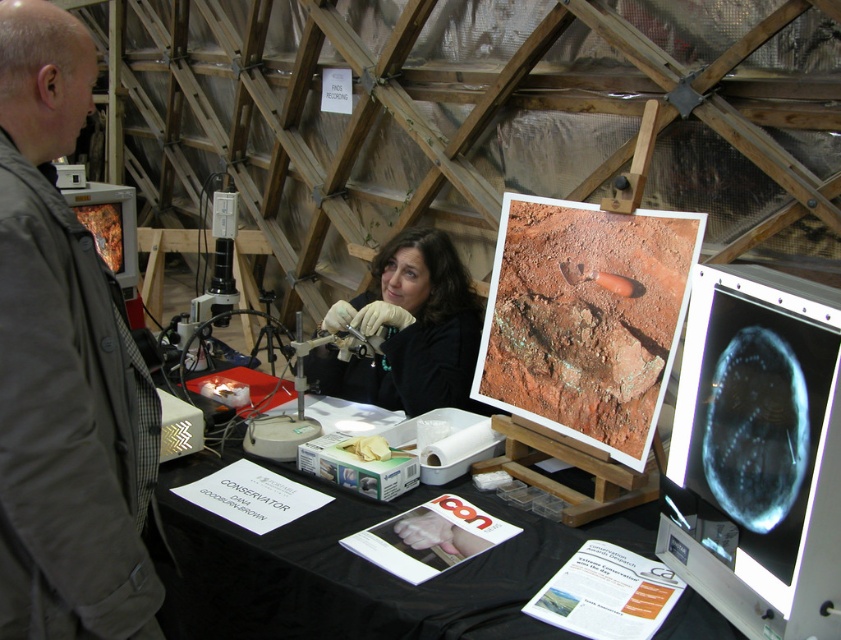
Question: Which point is farther to the camera?

Choices:
 (A) (x=101, y=266)
 (B) (x=484, y=630)
 (C) (x=78, y=198)

Answer: (C)

Question: Is blue glossy monitor at upper right closer to camera compared to metallic orange computer monitor at left?

Choices:
 (A) no
 (B) yes

Answer: (B)

Question: Considering the relative positions of blue glossy monitor at upper right and matte black gloves at center in the image provided, where is blue glossy monitor at upper right located with respect to matte black gloves at center?

Choices:
 (A) left
 (B) right

Answer: (B)

Question: Does black paper table at center appear over matte black gloves at center?

Choices:
 (A) yes
 (B) no

Answer: (B)

Question: Which object is closer to the camera taking this photo?

Choices:
 (A) matte black gloves at center
 (B) metallic orange computer monitor at left
 (C) blue glossy monitor at upper right
 (D) black paper table at center

Answer: (C)

Question: Which object is positioned closest to the blue glossy monitor at upper right?

Choices:
 (A) gray fabric jacket at left
 (B) matte black gloves at center
 (C) metallic orange computer monitor at left
 (D) black paper table at center

Answer: (D)